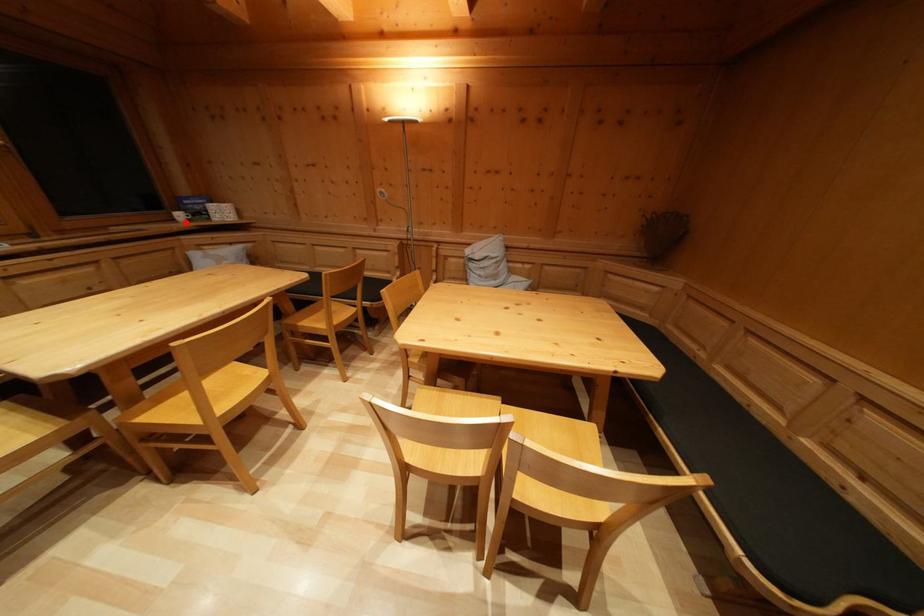
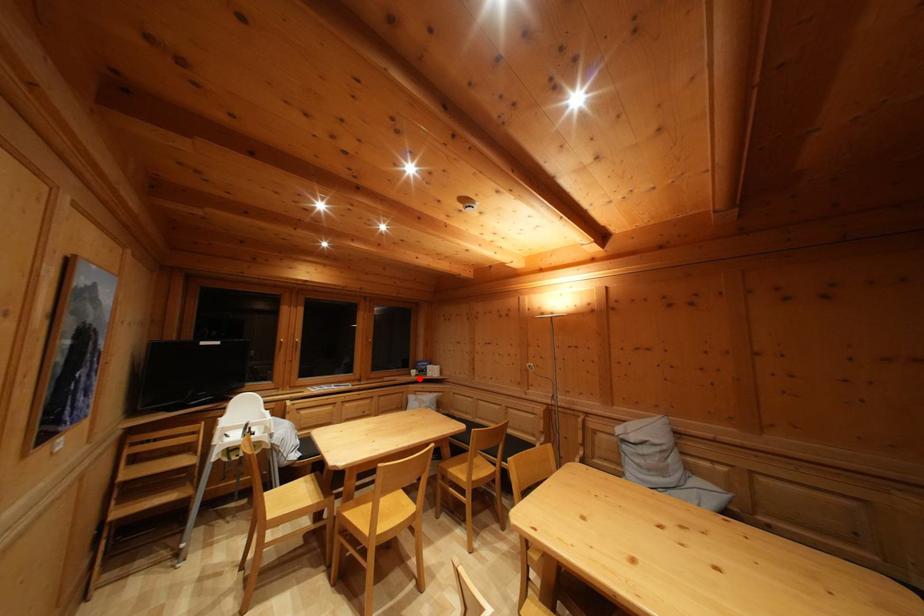
I am providing you with two images of the same scene from different viewpoints. A red point is marked on the first image and another point is marked on the second image. Is the red point in image1 aligned with the point shown in image2?

Yes